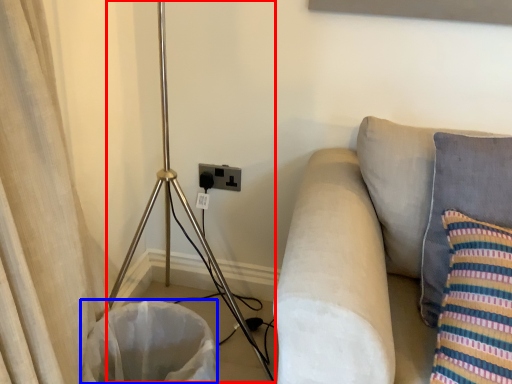
Question: Which of the following is the closest to the observer, tripod (highlighted by a red box) or laundry basket (highlighted by a blue box)?

Choices:
 (A) tripod
 (B) laundry basket

Answer: (A)